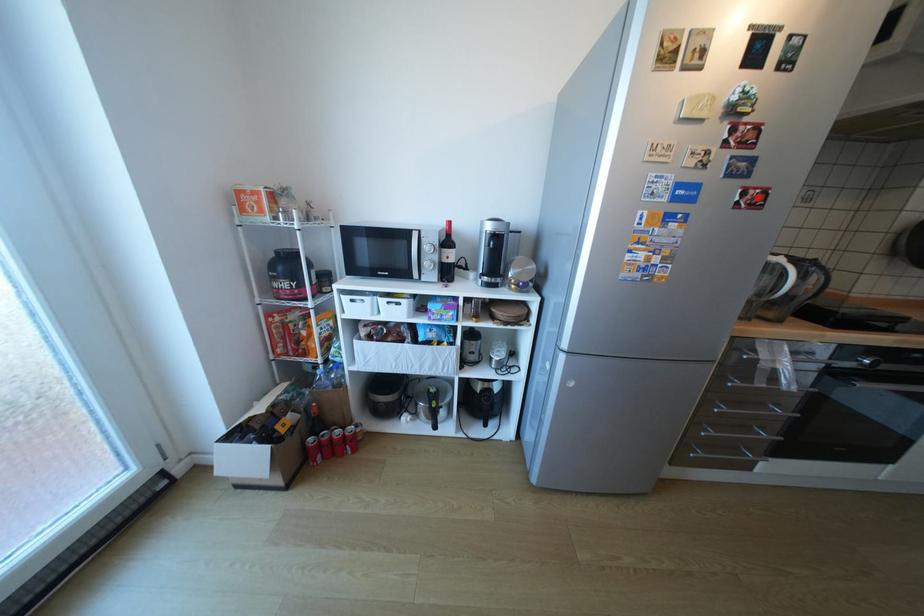
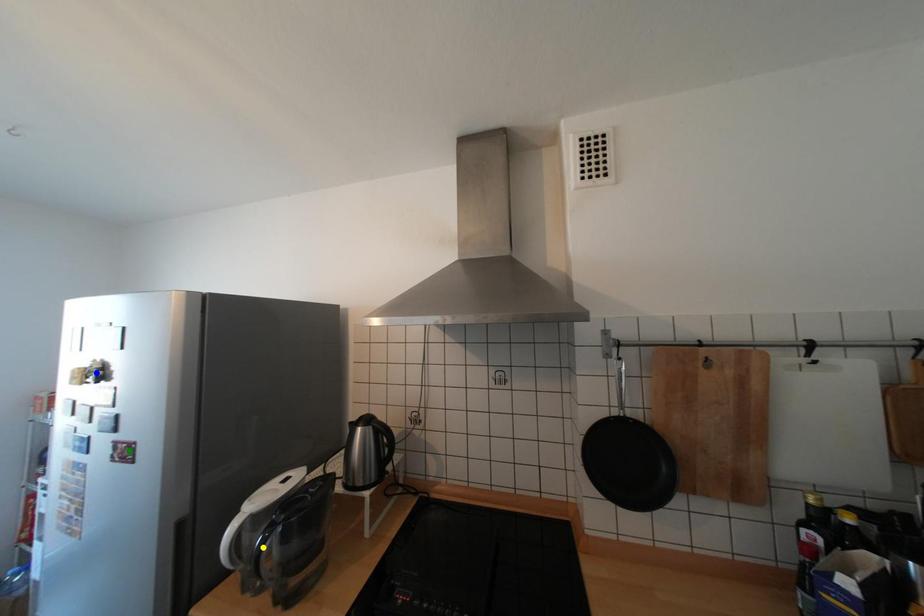
Question: I am providing you with two images of the same scene from different viewpoints. A red point is marked on the first image. You are given multiple points on the second image. Which point in image 2 is actually the same real-world point as the red point in image 1?

Choices:
 (A) green point
 (B) yellow point
 (C) blue point

Answer: (A)